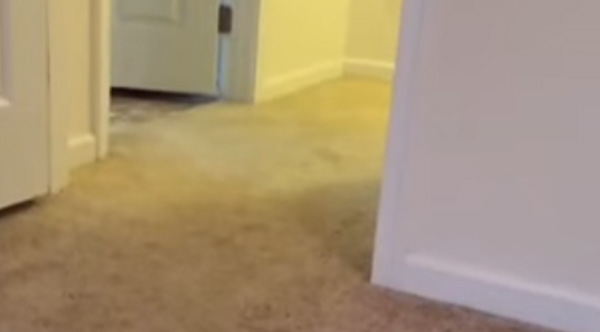
Where is `carpet`? Image resolution: width=600 pixels, height=332 pixels. carpet is located at coordinates (230, 239).